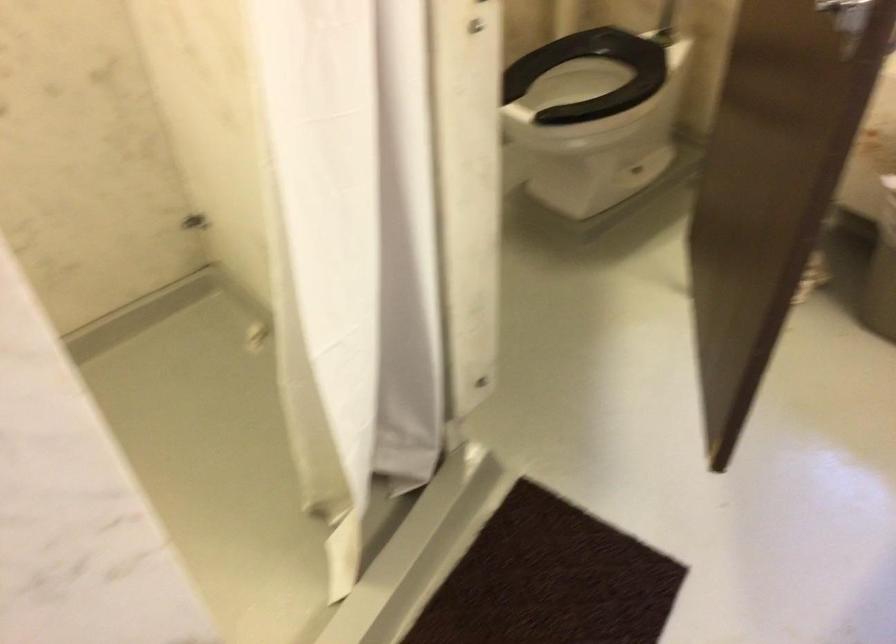
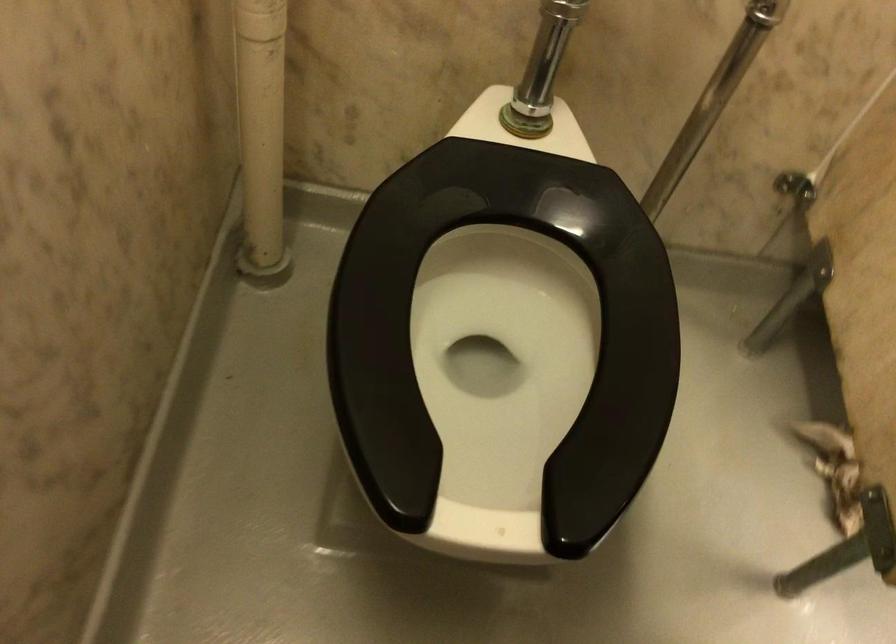
In the second image, find the point that corresponds to [612,122] in the first image.

(504, 332)